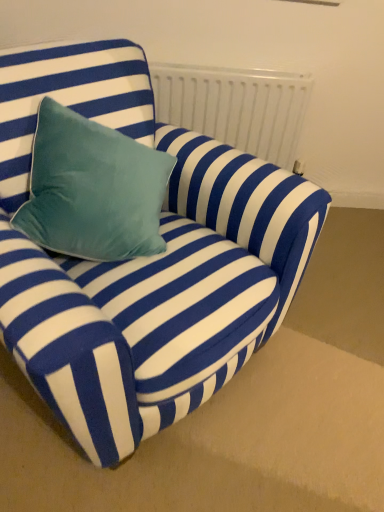
Question: Visually, is blue velvet couch at center positioned to the left or to the right of white matte radiator at upper center?

Choices:
 (A) right
 (B) left

Answer: (B)

Question: In the image, is blue velvet couch at center positioned in front of or behind white matte radiator at upper center?

Choices:
 (A) behind
 (B) front

Answer: (B)

Question: Considering the positions of point (119, 404) and point (225, 74), is point (119, 404) closer or farther from the camera than point (225, 74)?

Choices:
 (A) closer
 (B) farther

Answer: (A)

Question: Looking at their shapes, would you say white matte radiator at upper center is wider or thinner than blue velvet couch at center?

Choices:
 (A) wide
 (B) thin

Answer: (B)

Question: In terms of height, does white matte radiator at upper center look taller or shorter compared to blue velvet couch at center?

Choices:
 (A) short
 (B) tall

Answer: (A)

Question: Is white matte radiator at upper center bigger or smaller than blue velvet couch at center?

Choices:
 (A) small
 (B) big

Answer: (A)

Question: Considering the relative positions of white matte radiator at upper center and blue velvet couch at center in the image provided, is white matte radiator at upper center to the left or to the right of blue velvet couch at center?

Choices:
 (A) left
 (B) right

Answer: (B)